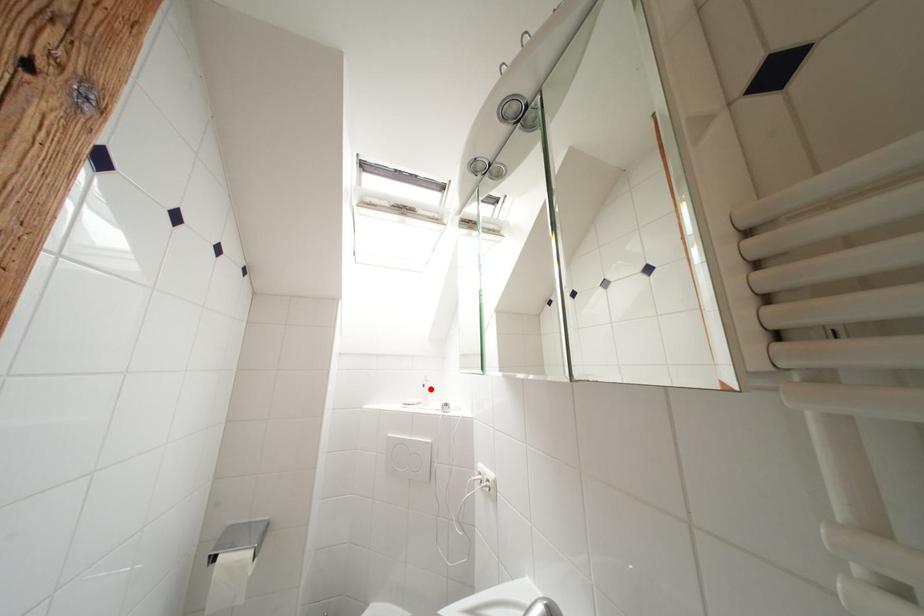
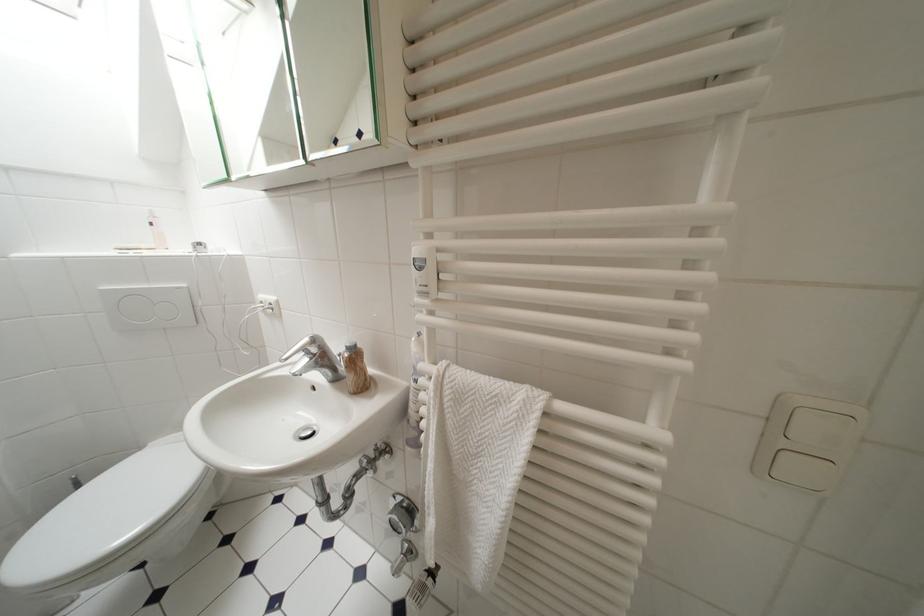
Locate, in the second image, the point that corresponds to the highlighted location in the first image.

(159, 227)